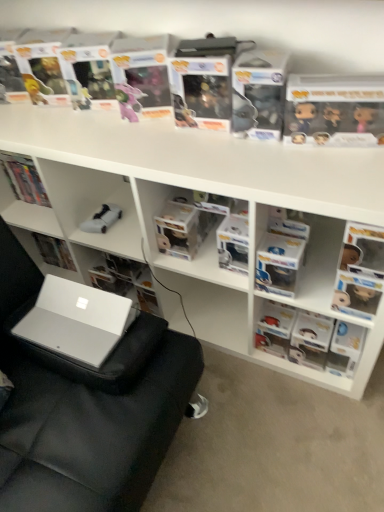
Question: From the image's perspective, is white matte book at center, arranged as the first book when viewed from the left, beneath matte plastic figurine at right, placed as the third book when sorted from left to right?

Choices:
 (A) yes
 (B) no

Answer: (B)

Question: Considering the relative positions of white matte book at center, arranged as the first book when viewed from the left, and matte plastic figurine at right, arranged as the 1th book when viewed from the right, in the image provided, is white matte book at center, arranged as the first book when viewed from the left, to the left of matte plastic figurine at right, arranged as the 1th book when viewed from the right, from the viewer's perspective?

Choices:
 (A) yes
 (B) no

Answer: (A)

Question: Is white matte book at center, arranged as the first book when viewed from the left, at the right side of matte plastic figurine at right, arranged as the 1th book when viewed from the right?

Choices:
 (A) no
 (B) yes

Answer: (A)

Question: From the image's perspective, would you say white matte book at center, the third book in the right-to-left sequence, is positioned over matte plastic figurine at right, placed as the third book when sorted from left to right?

Choices:
 (A) no
 (B) yes

Answer: (B)

Question: Is matte plastic figurine at right, placed as the third book when sorted from left to right, at the back of white matte book at center, the third book in the right-to-left sequence?

Choices:
 (A) no
 (B) yes

Answer: (A)

Question: Could you tell me if white matte book at center, the third book in the right-to-left sequence, is turned towards matte plastic figurine at right, placed as the third book when sorted from left to right?

Choices:
 (A) no
 (B) yes

Answer: (A)

Question: From the image's perspective, is clear plastic book at upper center, the 2th paperback book when ordered from right to left, below matte plastic figurine at right, placed as the third book when sorted from left to right?

Choices:
 (A) no
 (B) yes

Answer: (A)

Question: Can you confirm if clear plastic book at upper center, placed as the first paperback book when sorted from left to right, is bigger than matte plastic figurine at right, placed as the third book when sorted from left to right?

Choices:
 (A) yes
 (B) no

Answer: (B)

Question: Is clear plastic book at upper center, placed as the first paperback book when sorted from left to right, aimed at matte plastic figurine at right, arranged as the 1th book when viewed from the right?

Choices:
 (A) no
 (B) yes

Answer: (A)

Question: Does clear plastic book at upper center, the 2th paperback book when ordered from right to left, appear on the right side of matte plastic figurine at right, arranged as the 1th book when viewed from the right?

Choices:
 (A) yes
 (B) no

Answer: (B)

Question: Would you say clear plastic book at upper center, placed as the first paperback book when sorted from left to right, contains matte plastic figurine at right, arranged as the 1th book when viewed from the right?

Choices:
 (A) yes
 (B) no

Answer: (B)

Question: Is clear plastic book at upper center, the 2th paperback book when ordered from right to left, not inside matte plastic figurine at right, arranged as the 1th book when viewed from the right?

Choices:
 (A) yes
 (B) no

Answer: (A)

Question: Is white matte book at center, arranged as the first book when viewed from the left, at the right side of white plastic shelves at upper center?

Choices:
 (A) no
 (B) yes

Answer: (A)